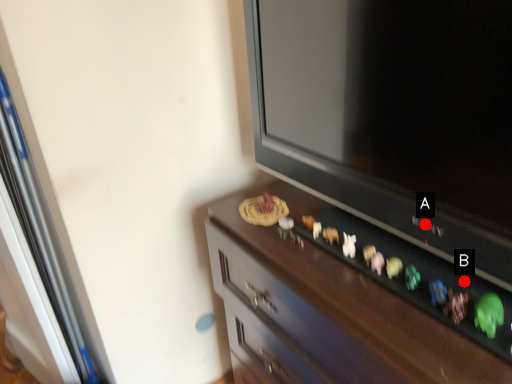
Question: Two points are circled on the image, labeled by A and B beside each circle. Which point is closer to the camera taking this photo?

Choices:
 (A) A is closer
 (B) B is closer

Answer: (B)